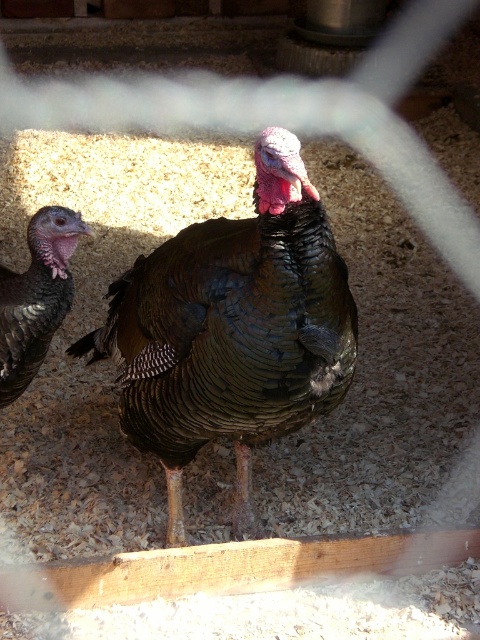
Between shiny dark brown turkey at center and shiny brown turkey at left, which one appears on the right side from the viewer's perspective?

shiny dark brown turkey at center is more to the right.

Which is behind, point (235, 314) or point (54, 221)?

Point (54, 221)

Image resolution: width=480 pixels, height=640 pixels. Identify the location of shiny dark brown turkey at center. (232, 330).